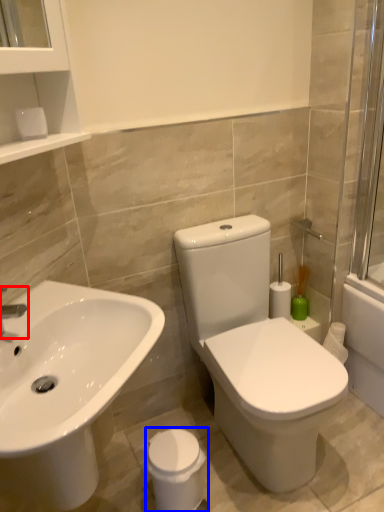
Question: Which object is further to the camera taking this photo, tap (highlighted by a red box) or porcelain (highlighted by a blue box)?

Choices:
 (A) tap
 (B) porcelain

Answer: (B)